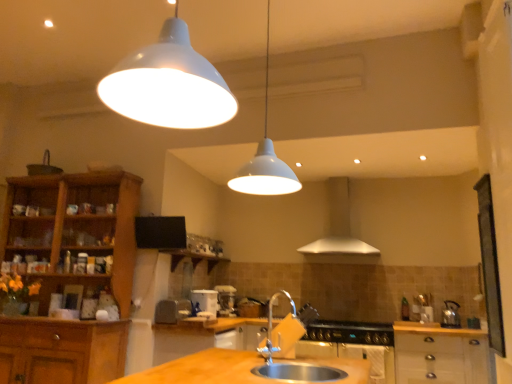
In order to face silver metallic sink at lower center, should I rotate leftwards or rightwards?

Rotate your view right by about 5.947°.

Measure the distance between point (280, 373) and camera.

Point (280, 373) and camera are 7.79 feet apart.

Find the location of `wooden cabinet at lower right, placed as the second cabinetry when sorted from left to right`. wooden cabinet at lower right, placed as the second cabinetry when sorted from left to right is located at coordinates (440, 354).

The width and height of the screenshot is (512, 384). What do you see at coordinates (265, 158) in the screenshot? I see `white matte pendant light at upper center` at bounding box center [265, 158].

This screenshot has width=512, height=384. What are the coordinates of `black matte gas stove at lower center` in the screenshot? It's located at (350, 332).

What is the approximate height of satin nickel faucet at sink center?

satin nickel faucet at sink center is 15.15 inches in height.

Identify the location of silver metallic sink at lower center. (298, 372).

Could you tell me if black matte gas stove at lower center is turned towards matte plastic toaster at center, the first appliance when ordered from front to back?

No, black matte gas stove at lower center is not facing towards matte plastic toaster at center, the first appliance when ordered from front to back.

Between black matte gas stove at lower center and matte plastic toaster at center, which appears as the 2th appliance when viewed from the right, which one has less height?

With less height is black matte gas stove at lower center.

Which object is positioned more to the left, black matte gas stove at lower center or matte plastic toaster at center, the first appliance when ordered from front to back?

Positioned to the left is matte plastic toaster at center, the first appliance when ordered from front to back.

From a real-world perspective, which is physically below, black matte gas stove at lower center or matte plastic toaster at center, which appears as the 2th appliance when viewed from the right?

black matte gas stove at lower center.

From a real-world perspective, is black matte gas stove at lower center over wooden cabinet at lower right, positioned as the first cabinetry in right-to-left order?

Yes, from a real-world perspective, black matte gas stove at lower center is on top of wooden cabinet at lower right, positioned as the first cabinetry in right-to-left order.

Considering the sizes of objects black matte gas stove at lower center and wooden cabinet at lower right, placed as the second cabinetry when sorted from left to right, in the image provided, who is bigger, black matte gas stove at lower center or wooden cabinet at lower right, placed as the second cabinetry when sorted from left to right,?

Bigger between the two is wooden cabinet at lower right, placed as the second cabinetry when sorted from left to right.

Is black matte gas stove at lower center far from wooden cabinet at lower right, placed as the second cabinetry when sorted from left to right?

They are positioned close to each other.

Between black matte gas stove at lower center and wooden cabinet at lower right, positioned as the first cabinetry in right-to-left order, which one has larger width?

With larger width is wooden cabinet at lower right, positioned as the first cabinetry in right-to-left order.

Considering the relative positions of white matte pendant light at upper center and wooden cabinet at left, arranged as the 2th cabinetry when viewed from the right, in the image provided, is white matte pendant light at upper center behind wooden cabinet at left, arranged as the 2th cabinetry when viewed from the right,?

No, white matte pendant light at upper center is closer to the camera.

From the image's perspective, which object appears higher, white matte pendant light at upper center or wooden cabinet at left, which ranks as the 1th cabinetry in left-to-right order?

From the image's view, white matte pendant light at upper center is above.

Identify the location of the 1st cabinetry below the white matte pendant light at upper center (from a real-world perspective). (76, 229).

From a real-world perspective, is white matte pendant light at upper center over wooden cabinet at left, which ranks as the 1th cabinetry in left-to-right order?

Correct, in the physical world, white matte pendant light at upper center is higher than wooden cabinet at left, which ranks as the 1th cabinetry in left-to-right order.

Can you see silver metallic sink at lower center touching wooden cabinet at lower right, placed as the second cabinetry when sorted from left to right?

silver metallic sink at lower center and wooden cabinet at lower right, placed as the second cabinetry when sorted from left to right, are clearly separated.

Which is more to the right, silver metallic sink at lower center or wooden cabinet at lower right, positioned as the first cabinetry in right-to-left order?

Positioned to the right is wooden cabinet at lower right, positioned as the first cabinetry in right-to-left order.

Is silver metallic sink at lower center positioned before wooden cabinet at lower right, positioned as the first cabinetry in right-to-left order?

Yes, silver metallic sink at lower center is closer to the camera.

From a real-world perspective, does satin nickel faucet at sink center stand above stainless steel oven at lower center?

Yes.

Is satin nickel faucet at sink center to the right of stainless steel oven at lower center from the viewer's perspective?

Incorrect, satin nickel faucet at sink center is not on the right side of stainless steel oven at lower center.

Which of these two, satin nickel faucet at sink center or stainless steel oven at lower center, stands taller?

stainless steel oven at lower center.

Between point (295, 306) and point (378, 353), which one is positioned behind?

Positioned behind is point (295, 306).

Which object is thinner, wooden cabinet at left, which ranks as the 1th cabinetry in left-to-right order, or silver metallic exhaust hood at center?

silver metallic exhaust hood at center.

Which is closer, (90,230) or (331,241)?

Point (90,230) appears to be closer to the viewer than point (331,241).

Based on their positions, is wooden cabinet at left, arranged as the 2th cabinetry when viewed from the right, located to the left or right of silver metallic exhaust hood at center?

From the image, it's evident that wooden cabinet at left, arranged as the 2th cabinetry when viewed from the right, is to the left of silver metallic exhaust hood at center.

The height and width of the screenshot is (384, 512). Identify the location of cabinetry on the left side of silver metallic exhaust hood at center. (76, 229).

In terms of height, does stainless steel oven at lower center look taller or shorter compared to silver metallic exhaust hood at center?

stainless steel oven at lower center is shorter than silver metallic exhaust hood at center.

In the image, is stainless steel oven at lower center on the left side or the right side of silver metallic exhaust hood at center?

stainless steel oven at lower center is positioned on silver metallic exhaust hood at center's left side.

Between point (317, 343) and point (342, 254), which one is positioned behind?

Positioned behind is point (342, 254).

In the scene shown: How many degrees apart are the facing directions of stainless steel oven at lower center and silver metallic exhaust hood at center?

The angular difference between stainless steel oven at lower center and silver metallic exhaust hood at center is 0.15 degrees.

Where is `appliance that is on the left side of black matte gas stove at lower center`? This screenshot has height=384, width=512. appliance that is on the left side of black matte gas stove at lower center is located at coordinates (172, 310).

The height and width of the screenshot is (384, 512). Identify the location of gas stove behind the wooden cabinet at lower right, positioned as the first cabinetry in right-to-left order. (350, 332).

From the picture: From the image, which object appears to be nearer to satin nickel faucet at sink center, stainless steel oven at lower center or polished stainless steel kettle at right, which is the 2th appliance from front to back?

Based on the image, stainless steel oven at lower center appears to be nearer to satin nickel faucet at sink center.

From the picture: Looking at the image, which one is located further to satin nickel faucet at sink center, silver metallic sink at lower center or wooden cabinet at lower right, placed as the second cabinetry when sorted from left to right?

silver metallic sink at lower center is positioned further to the anchor satin nickel faucet at sink center.

Looking at the image, which one is located closer to matte plastic toaster at center, arranged as the second appliance when viewed from the back, satin nickel faucet at sink center or white matte pendant light at upper center?

satin nickel faucet at sink center.

Which object lies nearer to the anchor point wooden cabinet at lower right, positioned as the first cabinetry in right-to-left order, polished stainless steel kettle at right, marked as the 1th appliance in a back-to-front arrangement, or white matte pendant light at upper center?

polished stainless steel kettle at right, marked as the 1th appliance in a back-to-front arrangement, is positioned closer to the anchor wooden cabinet at lower right, positioned as the first cabinetry in right-to-left order.

From the image, which object appears to be nearer to silver metallic sink at lower center, matte plastic toaster at center, which appears as the 2th appliance when viewed from the right, or black matte gas stove at lower center?

matte plastic toaster at center, which appears as the 2th appliance when viewed from the right, lies closer to silver metallic sink at lower center than the other object.

Considering their positions, is black matte gas stove at lower center positioned further to stainless steel oven at lower center than satin nickel faucet at sink center?

The object further to stainless steel oven at lower center is satin nickel faucet at sink center.

Which object lies further to the anchor point stainless steel oven at lower center, wooden cabinet at lower right, positioned as the first cabinetry in right-to-left order, or wooden cabinet at left, which ranks as the 1th cabinetry in left-to-right order?

wooden cabinet at left, which ranks as the 1th cabinetry in left-to-right order, is positioned further to the anchor stainless steel oven at lower center.

Consider the image. Which object lies further to the anchor point wooden cabinet at lower right, placed as the second cabinetry when sorted from left to right, black matte gas stove at lower center or silver metallic exhaust hood at center?

silver metallic exhaust hood at center is positioned further to the anchor wooden cabinet at lower right, placed as the second cabinetry when sorted from left to right.

Image resolution: width=512 pixels, height=384 pixels. I want to click on oven positioned between white matte pendant light at upper center and silver metallic exhaust hood at center from near to far, so click(353, 356).

This screenshot has width=512, height=384. In order to click on appliance positioned between white matte pendant light at upper center and black matte gas stove at lower center from near to far in this screenshot , I will do `click(172, 310)`.

Identify the location of lamp between wooden cabinet at left, arranged as the 2th cabinetry when viewed from the right, and silver metallic exhaust hood at center from left to right. (265, 158).

I want to click on gas stove between matte plastic toaster at center, which appears as the 2th appliance when viewed from the right, and wooden cabinet at lower right, positioned as the first cabinetry in right-to-left order, in the horizontal direction, so click(350, 332).